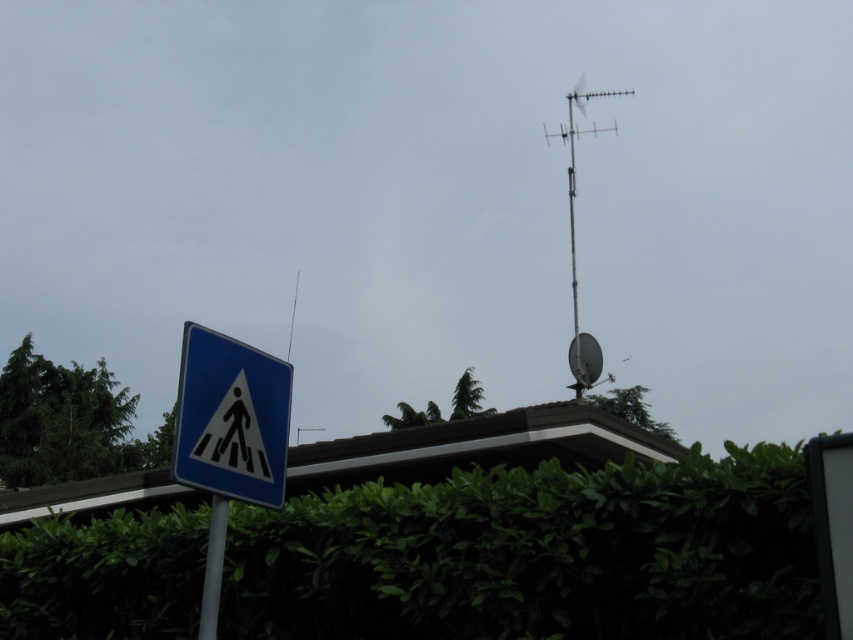
Question: Which object is the farthest from the metallic antenna at upper right?

Choices:
 (A) white plastic pole at lower left
 (B) green leafy hedge at lower center
 (C) blue plastic pedestrian crossing sign at left

Answer: (A)

Question: Which of the following is the farthest from the observer?

Choices:
 (A) (204, 609)
 (B) (218, 401)
 (C) (572, 266)
 (D) (569, 605)

Answer: (C)

Question: Can you confirm if green leafy hedge at lower center is positioned above blue plastic pedestrian crossing sign at left?

Choices:
 (A) no
 (B) yes

Answer: (A)

Question: Does green leafy hedge at lower center appear under metallic antenna at upper right?

Choices:
 (A) yes
 (B) no

Answer: (A)

Question: Can you confirm if green leafy hedge at lower center is positioned above white plastic pole at lower left?

Choices:
 (A) yes
 (B) no

Answer: (B)

Question: Which point is farther to the camera?

Choices:
 (A) (669, 566)
 (B) (209, 632)
 (C) (569, 116)
 (D) (186, 458)

Answer: (C)